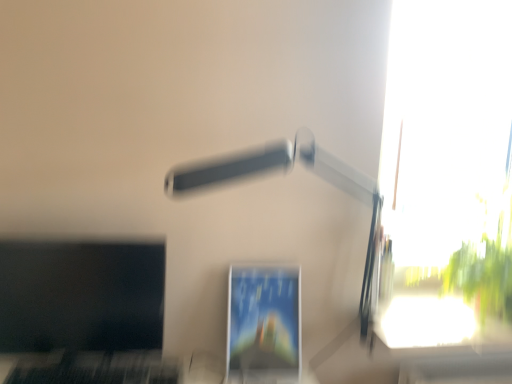
Question: Does white plastic lamp at upper center have a larger size compared to matte plastic monitor at center, the second computer monitor from the left?

Choices:
 (A) no
 (B) yes

Answer: (B)

Question: Considering the relative sizes of white plastic lamp at upper center and matte plastic monitor at center, which is the first computer monitor from right to left, in the image provided, is white plastic lamp at upper center shorter than matte plastic monitor at center, which is the first computer monitor from right to left,?

Choices:
 (A) no
 (B) yes

Answer: (A)

Question: Is white plastic lamp at upper center smaller than matte plastic monitor at center, which is the first computer monitor from right to left?

Choices:
 (A) yes
 (B) no

Answer: (B)

Question: Is white plastic lamp at upper center outside of matte plastic monitor at center, the second computer monitor from the left?

Choices:
 (A) no
 (B) yes

Answer: (B)

Question: Is matte plastic monitor at center, the second computer monitor from the left, at the back of white plastic lamp at upper center?

Choices:
 (A) yes
 (B) no

Answer: (B)

Question: From a real-world perspective, is transparent glass window at upper right physically located above or below white plastic lamp at upper center?

Choices:
 (A) above
 (B) below

Answer: (A)

Question: Is transparent glass window at upper right wider or thinner than white plastic lamp at upper center?

Choices:
 (A) wide
 (B) thin

Answer: (B)

Question: Is transparent glass window at upper right inside the boundaries of white plastic lamp at upper center, or outside?

Choices:
 (A) inside
 (B) outside

Answer: (B)

Question: Considering the positions of transparent glass window at upper right and white plastic lamp at upper center in the image, is transparent glass window at upper right taller or shorter than white plastic lamp at upper center?

Choices:
 (A) tall
 (B) short

Answer: (A)

Question: Considering the relative positions of transparent glass window at upper right and matte plastic monitor at center, the second computer monitor from the left, in the image provided, is transparent glass window at upper right to the left or to the right of matte plastic monitor at center, the second computer monitor from the left,?

Choices:
 (A) left
 (B) right

Answer: (B)

Question: From the image's perspective, is transparent glass window at upper right above or below matte plastic monitor at center, which is the first computer monitor from right to left?

Choices:
 (A) below
 (B) above

Answer: (B)

Question: Is point (460, 130) closer or farther from the camera than point (249, 365)?

Choices:
 (A) closer
 (B) farther

Answer: (B)

Question: Is transparent glass window at upper right inside or outside of matte plastic monitor at center, the second computer monitor from the left?

Choices:
 (A) inside
 (B) outside

Answer: (B)

Question: From the image's perspective, relative to matte black monitor at left, the second computer monitor in the right-to-left sequence, is transparent glass window at upper right above or below?

Choices:
 (A) above
 (B) below

Answer: (A)

Question: In the image, is transparent glass window at upper right positioned in front of or behind matte black monitor at left, the second computer monitor in the right-to-left sequence?

Choices:
 (A) behind
 (B) front

Answer: (A)